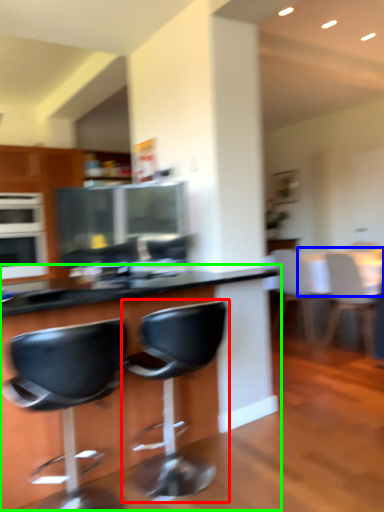
Question: Which is farther away from chair (highlighted by a red box)? table (highlighted by a blue box) or table (highlighted by a green box)?

Choices:
 (A) table
 (B) table

Answer: (A)